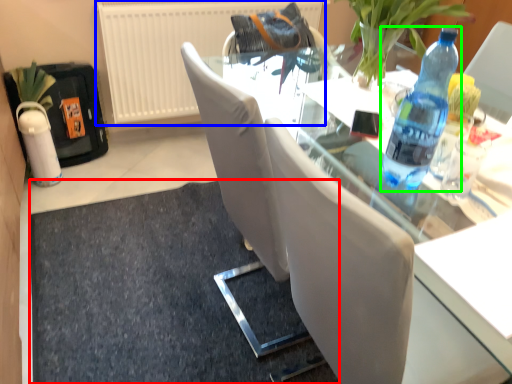
Question: Estimate the real-world distances between objects in this image. Which object is farther from doormat (highlighted by a red box), radiator (highlighted by a blue box) or bottle (highlighted by a green box)?

Choices:
 (A) radiator
 (B) bottle

Answer: (B)